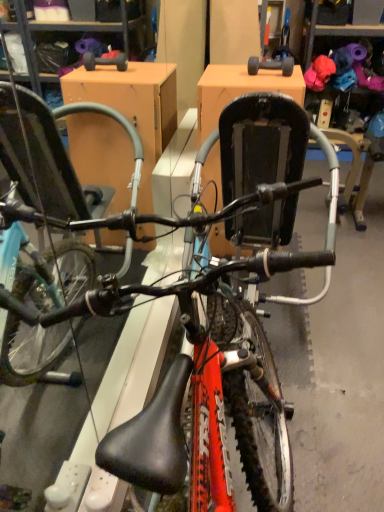
Question: Is shiny red bicycle at center facing away from gray rubber dumbbell at upper center?

Choices:
 (A) yes
 (B) no

Answer: (B)

Question: Could you tell me if shiny red bicycle at center is turned towards gray rubber dumbbell at upper center?

Choices:
 (A) yes
 (B) no

Answer: (B)

Question: Is shiny red bicycle at center further to camera compared to gray rubber dumbbell at upper center?

Choices:
 (A) no
 (B) yes

Answer: (A)

Question: Can gray rubber dumbbell at upper center be found inside shiny red bicycle at center?

Choices:
 (A) yes
 (B) no

Answer: (B)

Question: Would you say shiny red bicycle at center is a long distance from gray rubber dumbbell at upper center?

Choices:
 (A) no
 (B) yes

Answer: (B)

Question: Does shiny red bicycle at center appear on the left side of gray rubber dumbbell at upper center?

Choices:
 (A) yes
 (B) no

Answer: (A)

Question: Is gray rubber dumbbell at upper center at the left side of shiny red bicycle at center?

Choices:
 (A) yes
 (B) no

Answer: (B)

Question: Can you see gray rubber dumbbell at upper center touching shiny red bicycle at center?

Choices:
 (A) no
 (B) yes

Answer: (A)

Question: Is gray rubber dumbbell at upper center shorter than shiny red bicycle at center?

Choices:
 (A) no
 (B) yes

Answer: (B)

Question: From the image's perspective, is gray rubber dumbbell at upper center located beneath shiny red bicycle at center?

Choices:
 (A) yes
 (B) no

Answer: (B)

Question: Is the position of gray rubber dumbbell at upper center more distant than that of shiny red bicycle at center?

Choices:
 (A) no
 (B) yes

Answer: (B)

Question: Does gray rubber dumbbell at upper center have a lesser width compared to shiny red bicycle at center?

Choices:
 (A) no
 (B) yes

Answer: (B)

Question: From the image's perspective, is shiny red bicycle at center positioned above or below gray rubber dumbbell at upper center?

Choices:
 (A) below
 (B) above

Answer: (A)